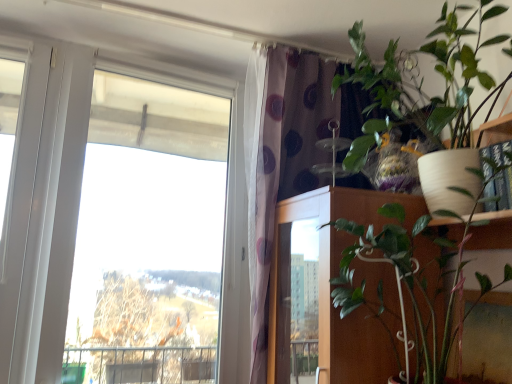
Find the location of `free space above transparent glass window at left (from a real-world perspective)`. free space above transparent glass window at left (from a real-world perspective) is located at coordinates (165, 63).